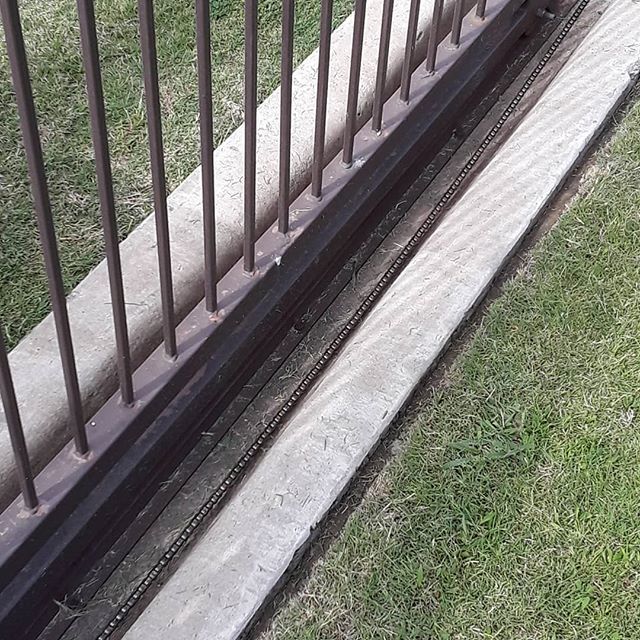
Locate an element on the screen. The image size is (640, 640). the left side concrete wall is located at coordinates coord(95,339).